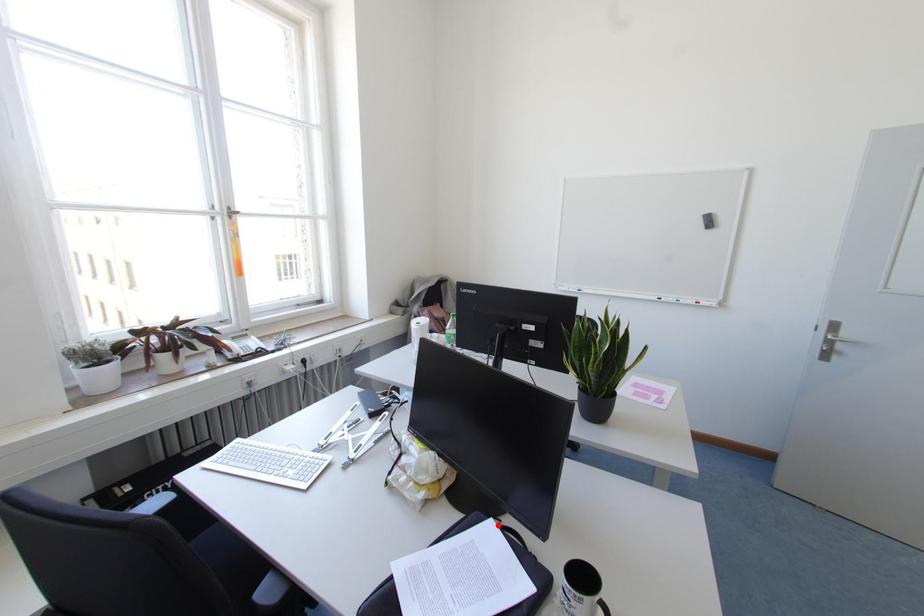
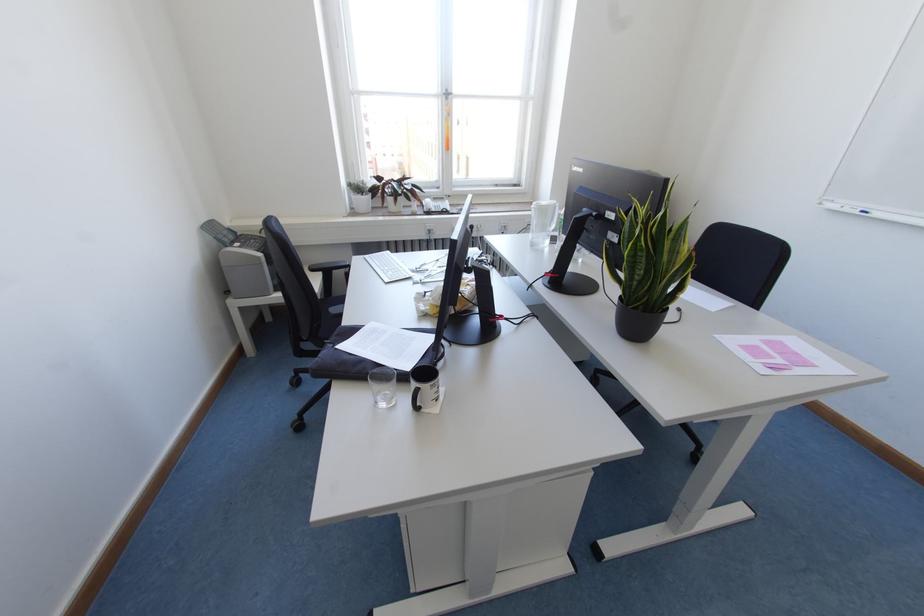
Question: I am providing you with two images of the same scene from different viewpoints. A red point is shown in image1. For the corresponding object point in image2, is it positioned nearer or farther from the camera?

Choices:
 (A) Nearer
 (B) Farther

Answer: (A)